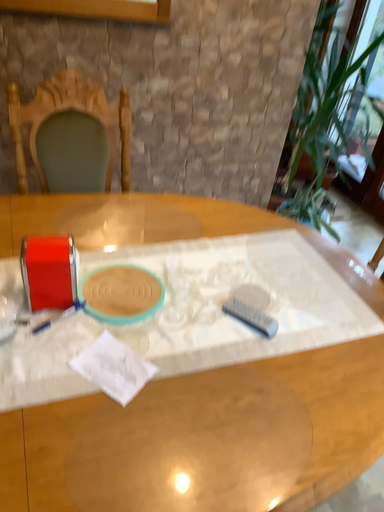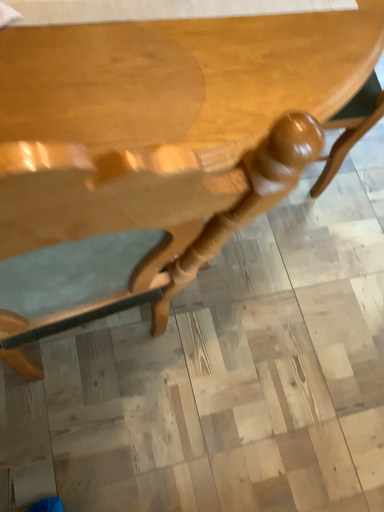
Question: Which way did the camera rotate in the video?

Choices:
 (A) rotated upward
 (B) rotated downward

Answer: (B)